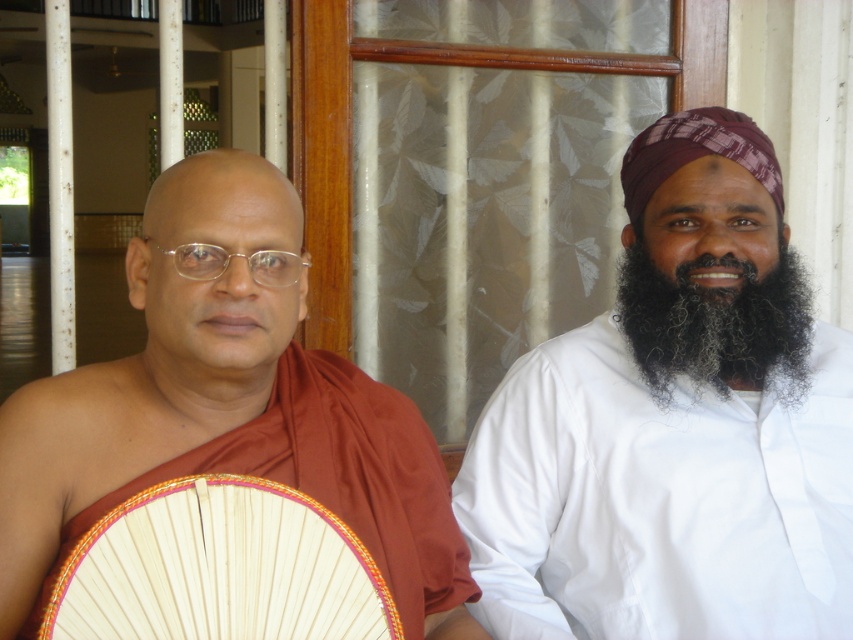
Does white cotton shirt at right have a smaller size compared to matte orange robe at left?

Incorrect, white cotton shirt at right is not smaller in size than matte orange robe at left.

Who is more distant from viewer, (822, 440) or (167, 397)?

Positioned behind is point (822, 440).

Is point (521, 513) farther from camera compared to point (178, 408)?

Yes, it is behind point (178, 408).

Locate an element on the screen. This screenshot has width=853, height=640. white cotton shirt at right is located at coordinates (674, 426).

Consider the image. Is white cotton shirt at right to the right of black curly beard at right from the viewer's perspective?

In fact, white cotton shirt at right is to the left of black curly beard at right.

Who is positioned more to the left, white cotton shirt at right or black curly beard at right?

Positioned to the left is white cotton shirt at right.

From the picture: Who is more forward, (726,630) or (809,291)?

Point (726,630) is more forward.

This screenshot has width=853, height=640. Find the location of `white cotton shirt at right`. white cotton shirt at right is located at coordinates (674, 426).

In the scene shown: Can you confirm if matte orange robe at left is smaller than black curly beard at right?

Actually, matte orange robe at left might be larger than black curly beard at right.

This screenshot has height=640, width=853. What do you see at coordinates (154, 364) in the screenshot?
I see `matte orange robe at left` at bounding box center [154, 364].

What do you see at coordinates (154, 364) in the screenshot?
I see `matte orange robe at left` at bounding box center [154, 364].

This screenshot has width=853, height=640. What are the coordinates of `matte orange robe at left` in the screenshot? It's located at (154, 364).